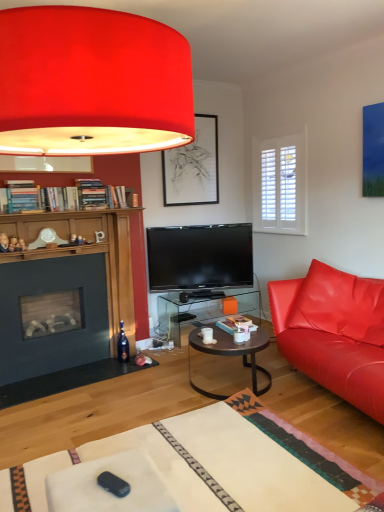
Question: Is white glossy coffee cup at center in contact with matte leather couch at right?

Choices:
 (A) no
 (B) yes

Answer: (A)

Question: Does white glossy coffee cup at center have a lesser height compared to matte leather couch at right?

Choices:
 (A) no
 (B) yes

Answer: (B)

Question: Is white glossy coffee cup at center positioned in front of matte leather couch at right?

Choices:
 (A) no
 (B) yes

Answer: (A)

Question: Can you confirm if white glossy coffee cup at center is taller than matte leather couch at right?

Choices:
 (A) no
 (B) yes

Answer: (A)

Question: From a real-world perspective, does white glossy coffee cup at center sit lower than matte leather couch at right?

Choices:
 (A) no
 (B) yes

Answer: (B)

Question: From the image's perspective, is metallic dark brown coffee table at center positioned above or below matte red lampshade at upper center?

Choices:
 (A) below
 (B) above

Answer: (A)

Question: Considering the positions of point (236, 345) and point (84, 34), is point (236, 345) closer or farther from the camera than point (84, 34)?

Choices:
 (A) farther
 (B) closer

Answer: (A)

Question: Is metallic dark brown coffee table at center bigger or smaller than matte red lampshade at upper center?

Choices:
 (A) big
 (B) small

Answer: (B)

Question: From a real-world perspective, is metallic dark brown coffee table at center positioned above or below matte red lampshade at upper center?

Choices:
 (A) above
 (B) below

Answer: (B)

Question: From the image's perspective, is translucent glass table at center above or below white glossy coffee cup at center?

Choices:
 (A) below
 (B) above

Answer: (A)

Question: Visually, is translucent glass table at center positioned to the left or to the right of white glossy coffee cup at center?

Choices:
 (A) left
 (B) right

Answer: (A)

Question: Does point (218, 296) appear closer or farther from the camera than point (238, 335)?

Choices:
 (A) farther
 (B) closer

Answer: (A)

Question: Is translucent glass table at center taller or shorter than white glossy coffee cup at center?

Choices:
 (A) short
 (B) tall

Answer: (B)

Question: In terms of height, does black plastic remote control at lower center look taller or shorter compared to matte leather couch at right?

Choices:
 (A) short
 (B) tall

Answer: (A)

Question: Is black plastic remote control at lower center in front of or behind matte leather couch at right in the image?

Choices:
 (A) behind
 (B) front

Answer: (B)